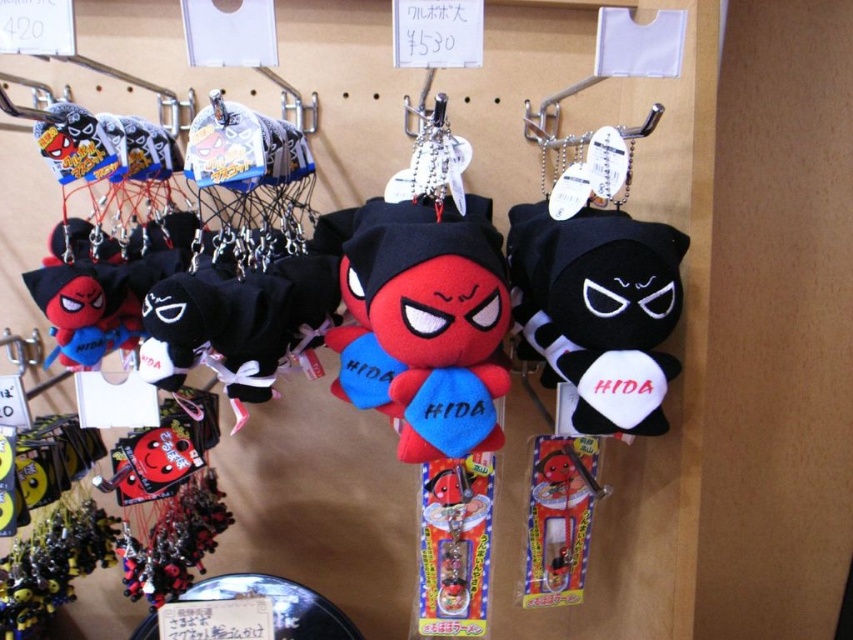
Question: Among these objects, which one is farthest from the camera?

Choices:
 (A) matte plush toy at center
 (B) black plush toy at center-right

Answer: (B)

Question: Is matte plush toy at center positioned in front of black plush toy at center-right?

Choices:
 (A) no
 (B) yes

Answer: (B)

Question: Observing the image, what is the correct spatial positioning of matte plush toy at center in reference to black plush toy at center-right?

Choices:
 (A) left
 (B) right

Answer: (A)

Question: Does matte plush toy at center appear on the left side of black plush toy at center-right?

Choices:
 (A) no
 (B) yes

Answer: (B)

Question: Which object appears closest to the camera in this image?

Choices:
 (A) matte plush toy at center
 (B) black plush toy at center-right

Answer: (A)

Question: Which point is closer to the camera?

Choices:
 (A) matte plush toy at center
 (B) black plush toy at center-right

Answer: (A)